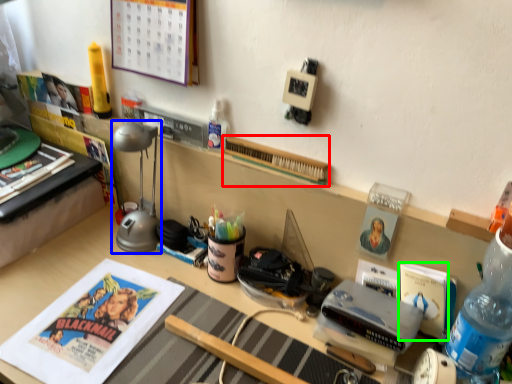
Question: Considering the real-world distances, which object is closest to book (highlighted by a red box)? table lamp (highlighted by a blue box) or paperback book (highlighted by a green box).

Choices:
 (A) table lamp
 (B) paperback book

Answer: (A)